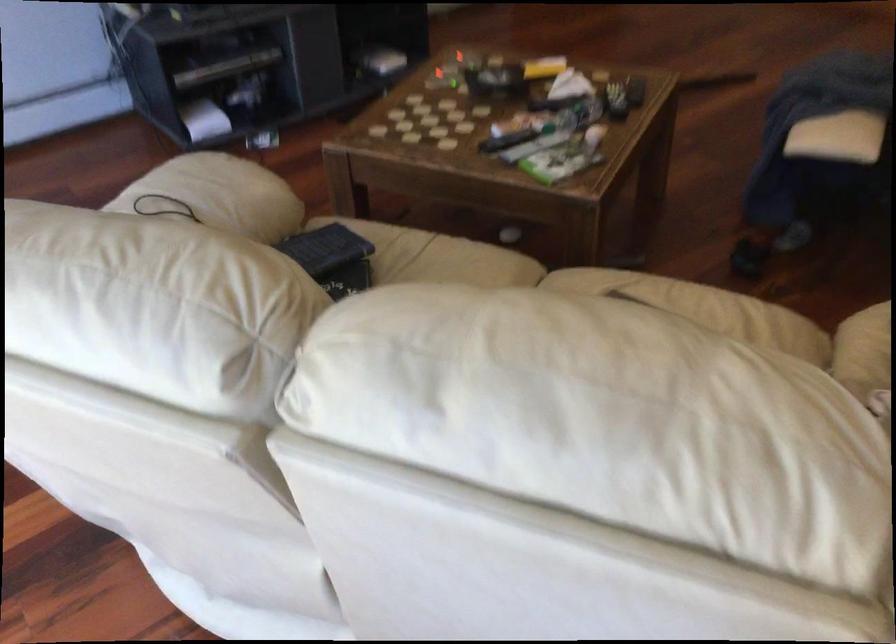
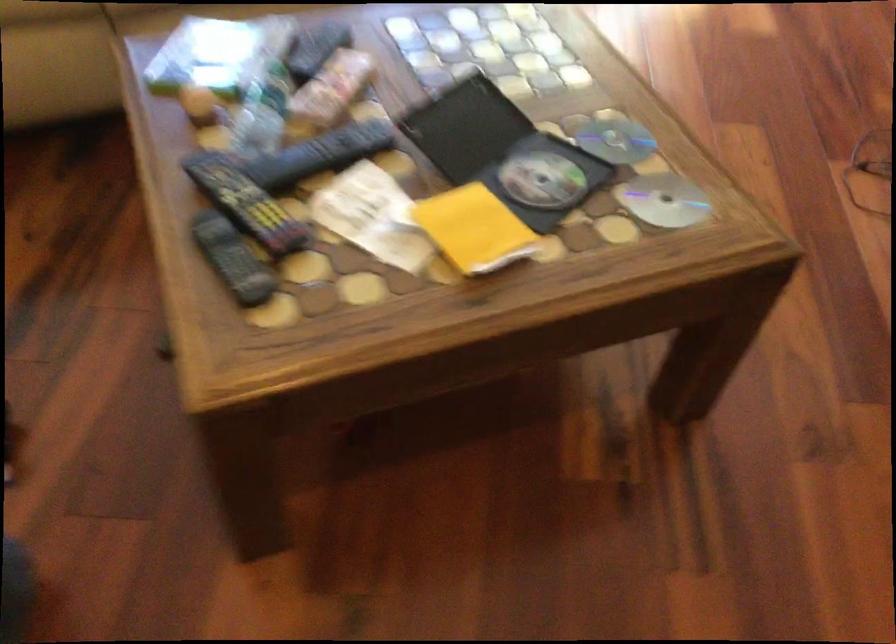
The point at (581, 100) is marked in the first image. Where is the corresponding point in the second image?

(262, 113)